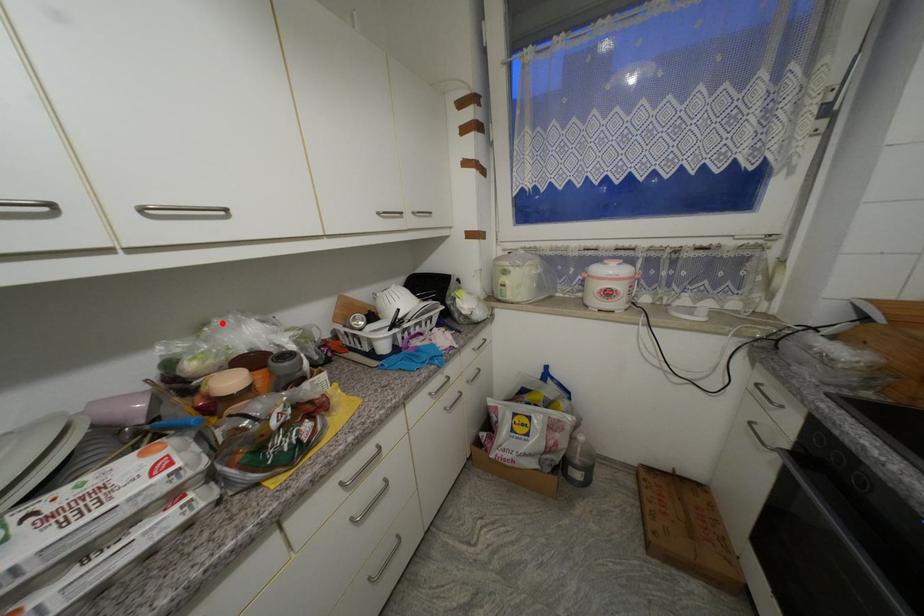
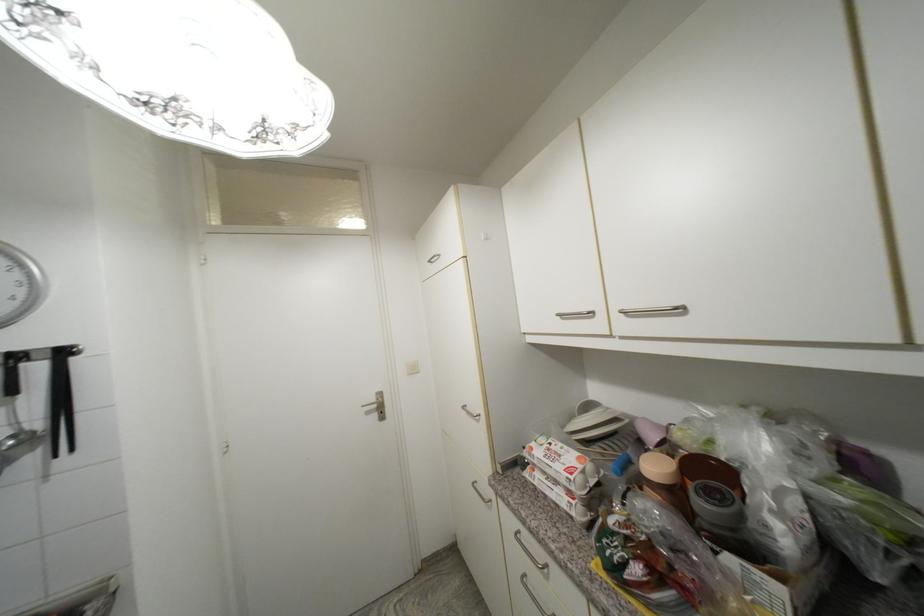
In the second image, find the point that corresponds to the highlighted location in the first image.

(730, 410)